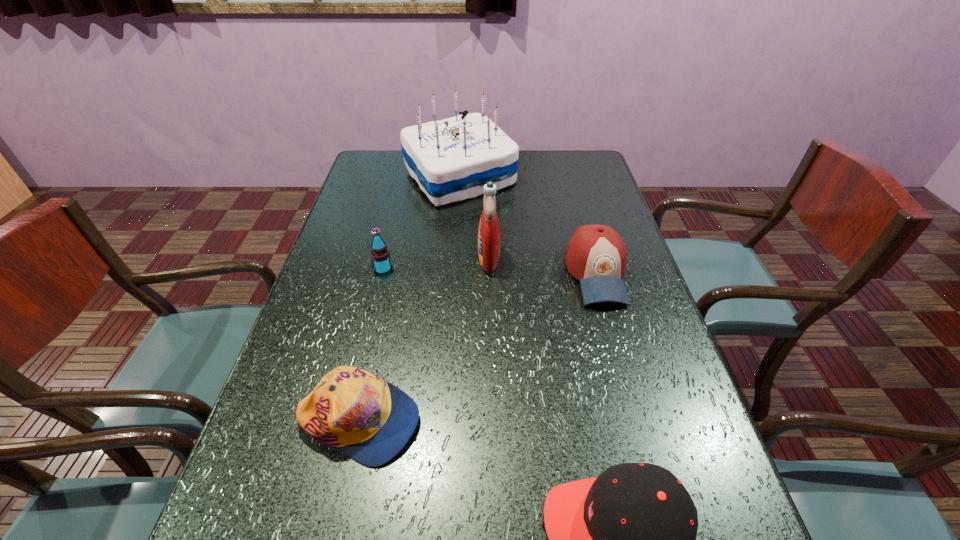
Locate an element on the screen. The height and width of the screenshot is (540, 960). vacant space that is in between the birthday cake and the second tallest object is located at coordinates (474, 217).

This screenshot has height=540, width=960. What are the coordinates of `object that can be found as the fourth closest to the soda` in the screenshot? It's located at (596, 255).

The image size is (960, 540). What are the coordinates of `the fourth closest object to the tallest object` in the screenshot? It's located at (370, 420).

Locate an element on the screen. The image size is (960, 540). vacant space that satisfies the following two spatial constraints: 1. on the front surface of the detergent; 2. on the front side of the soda is located at coordinates (489, 269).